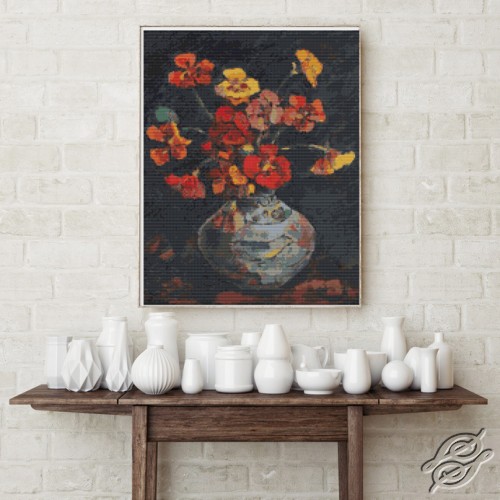
I want to click on vase, so click(x=119, y=379).